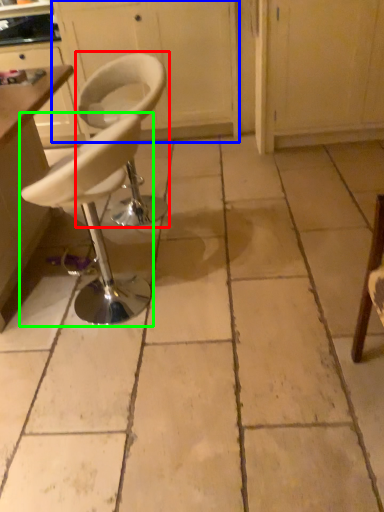
Question: Estimate the real-world distances between objects in this image. Which object is farther from chair (highlighted by a red box), cabinetry (highlighted by a blue box) or chair (highlighted by a green box)?

Choices:
 (A) cabinetry
 (B) chair

Answer: (A)